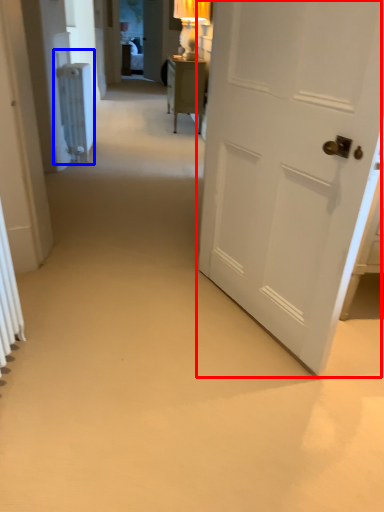
Question: Which of the following is the farthest to the observer, door (highlighted by a red box) or radiator (highlighted by a blue box)?

Choices:
 (A) door
 (B) radiator

Answer: (B)